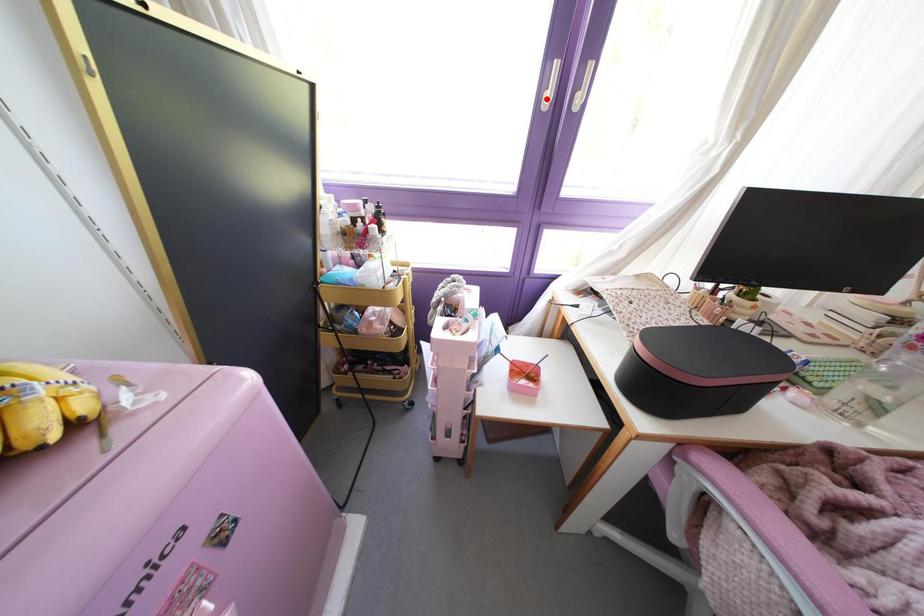
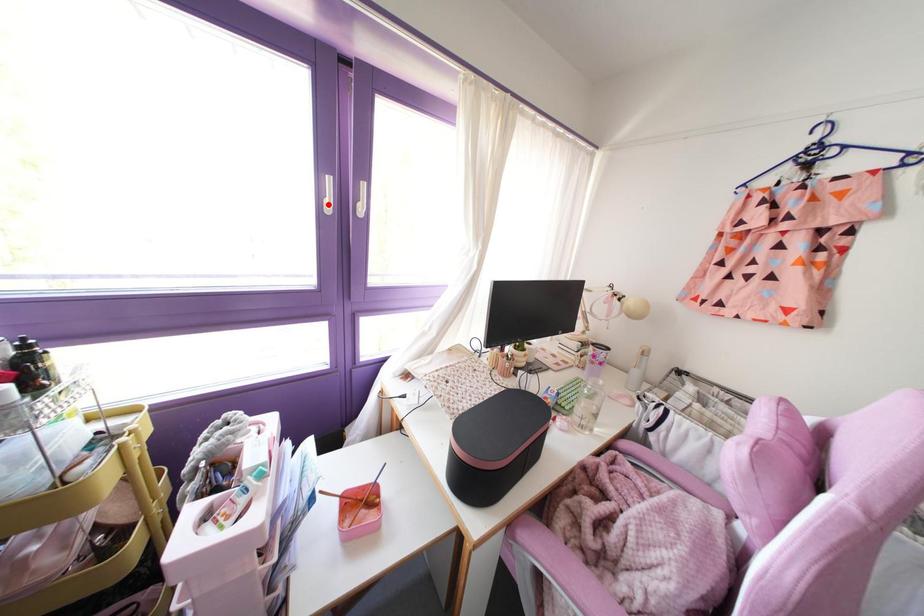
I am providing you with two images of the same scene from different viewpoints. A red point is marked on the first image and another point is marked on the second image. Is the marked point in image1 the same physical position as the marked point in image2?

Yes